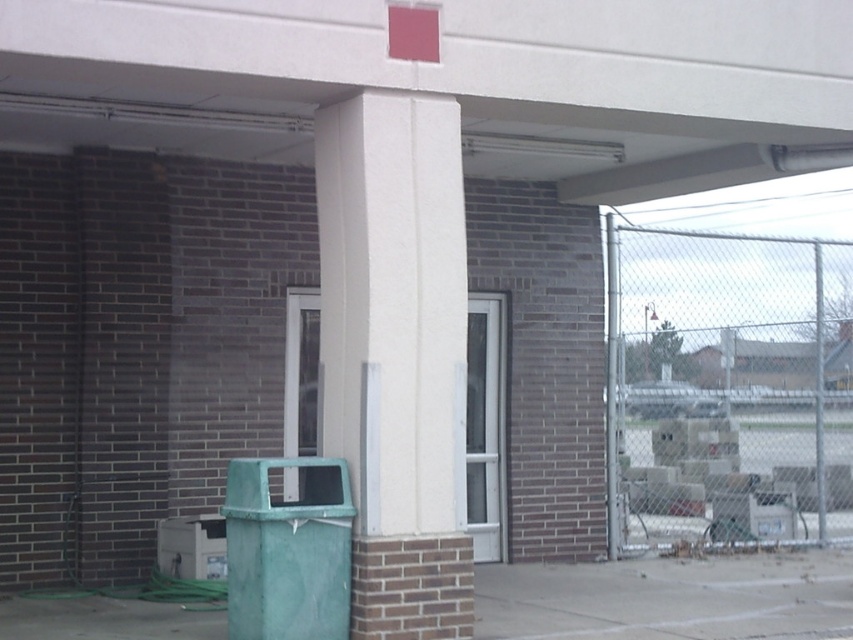
Is metal chain-link fence at right below white smooth pillar at center?

Correct, metal chain-link fence at right is located below white smooth pillar at center.

Describe the element at coordinates (727, 388) in the screenshot. I see `metal chain-link fence at right` at that location.

Identify the location of metal chain-link fence at right. The image size is (853, 640). (727, 388).